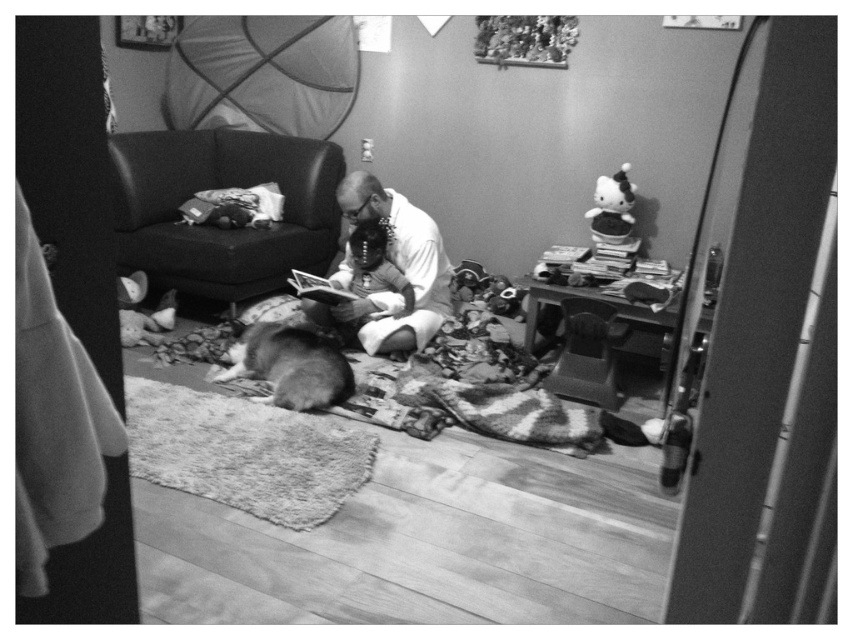
From the picture: Is leather couch at center to the left of white matte shirt at center from the viewer's perspective?

Correct, you'll find leather couch at center to the left of white matte shirt at center.

This screenshot has height=640, width=853. What do you see at coordinates (216, 227) in the screenshot?
I see `leather couch at center` at bounding box center [216, 227].

Is point (132, 152) closer to camera compared to point (364, 182)?

No, it is not.

Identify the location of leather couch at center. (216, 227).

Does white matte shirt at center appear under fluffy white dog at center?

No.

Is white matte shirt at center thinner than fluffy white dog at center?

Incorrect, white matte shirt at center's width is not less than fluffy white dog at center's.

Who is more distant from viewer, [403,234] or [311,396]?

Point [403,234]

You are a GUI agent. You are given a task and a screenshot of the screen. Output one action in this format:
    pyautogui.click(x=<x>, y=<y>)
    Task: Click on the white matte shirt at center
    This screenshot has width=853, height=640.
    Given the screenshot: What is the action you would take?
    pyautogui.click(x=397, y=268)

How distant is leather couch at center from fluffy white dog at center?

A distance of 31.96 inches exists between leather couch at center and fluffy white dog at center.

This screenshot has width=853, height=640. Find the location of `leather couch at center`. leather couch at center is located at coordinates (216, 227).

Locate an element on the screen. Image resolution: width=853 pixels, height=640 pixels. leather couch at center is located at coordinates (216, 227).